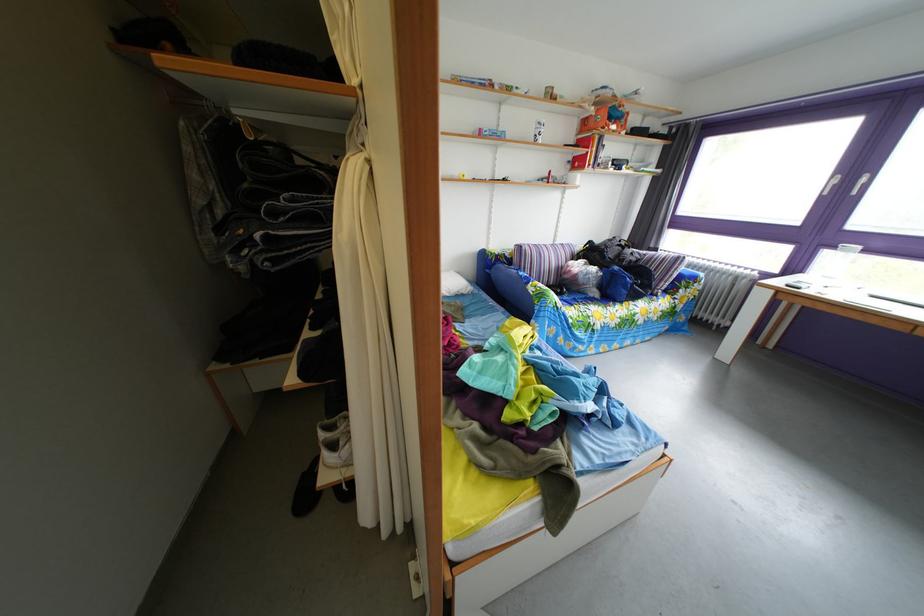
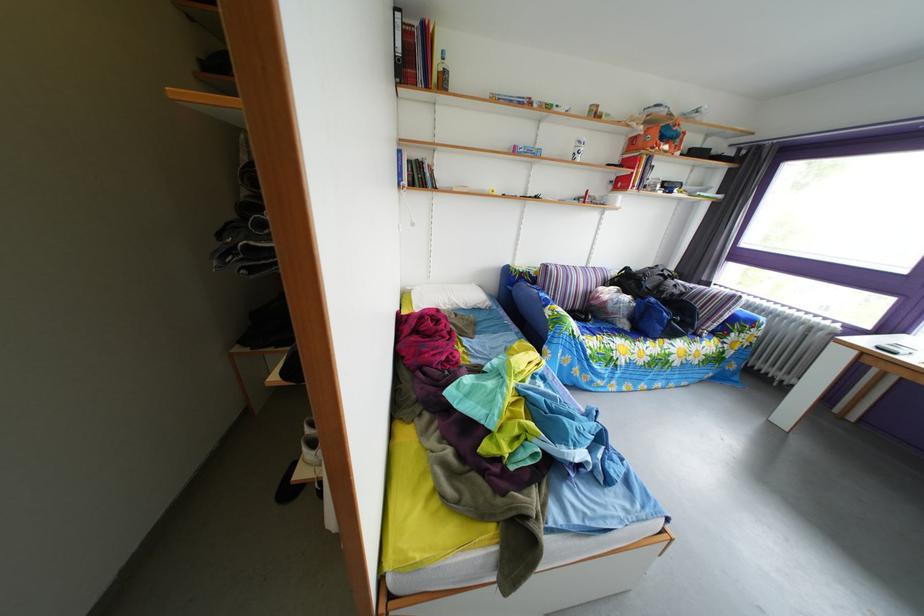
Question: What movement of the cameraman would produce the second image?

Choices:
 (A) Left
 (B) Right
 (C) Forward
 (D) Backward

Answer: (B)